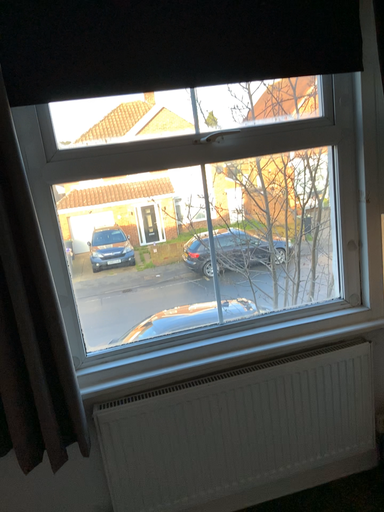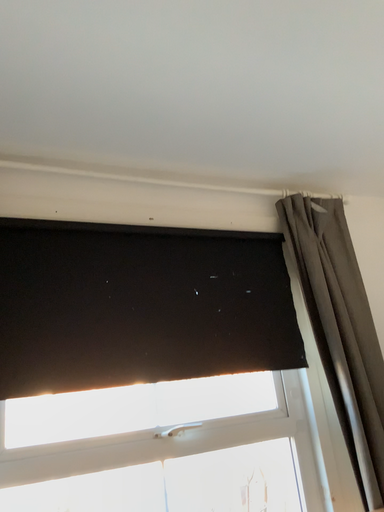
Question: How did the camera likely rotate when shooting the video?

Choices:
 (A) rotated downward
 (B) rotated upward

Answer: (B)